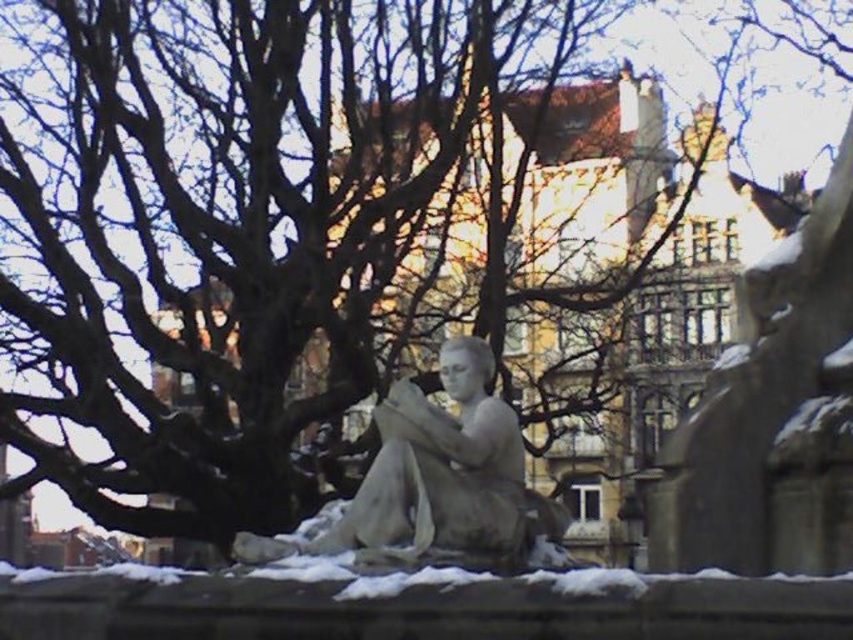
In the scene shown: You are an artist planning to sculpt a new statue that needs to be wider than the existing one. Given the space available between the white marble statue at center and the white powdery snow at lower center, can you determine if your new statue will fit if it is 1.2 meters wide?

The white marble statue at center is thinner than the white powdery snow at lower center. Since the snow is wider, the space between them might accommodate the 1.2 meter wide statue. However, exact dimensions aren

You are an artist planning to sketch this winter scene. You need to focus on the main elements. Which object takes up more space in the image, the white marble statue at center or the white powdery snow at lower center?

The white marble statue at center occupies less space than white powdery snow at lower center, so the snow takes up more space in the image.